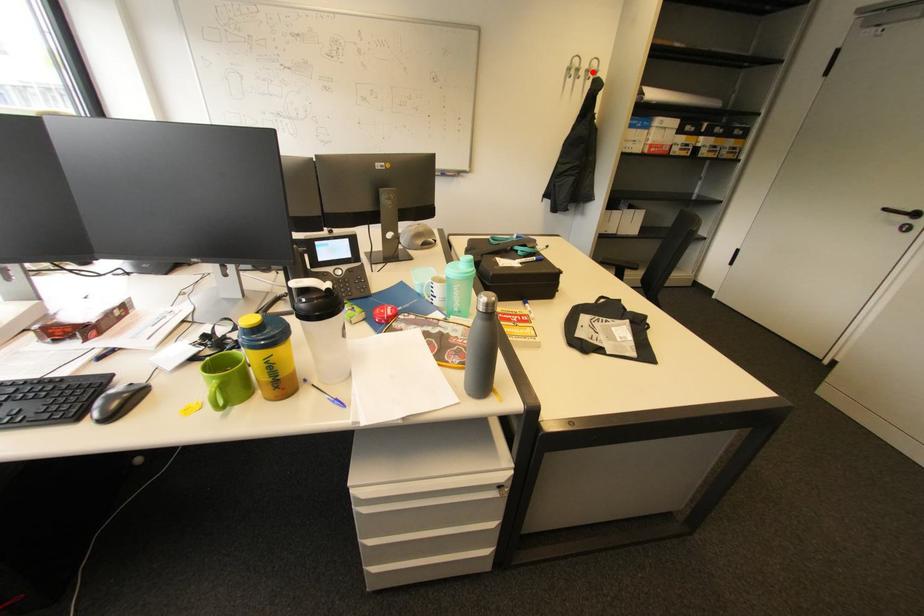
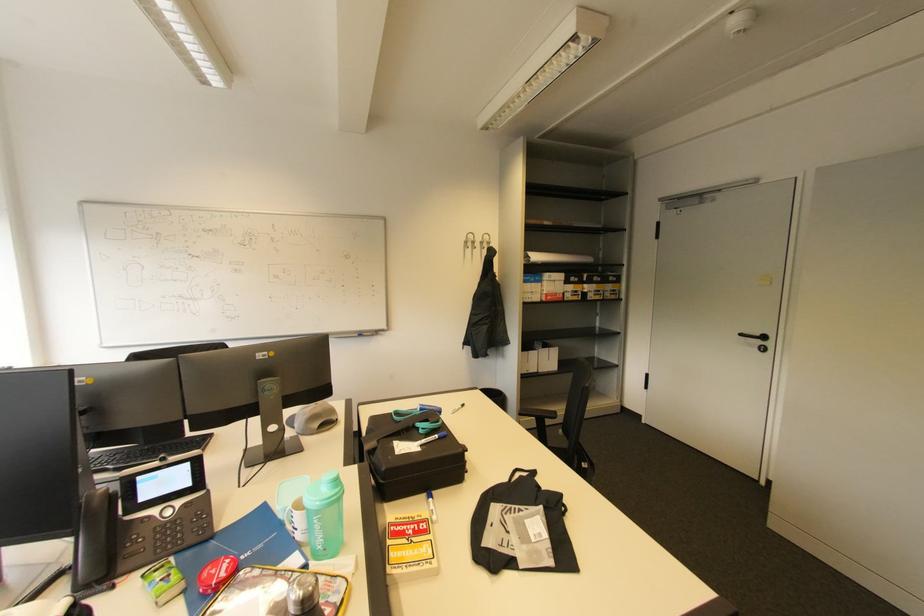
Find the pixel in the second image that matches the highlighted location in the first image.

(487, 244)